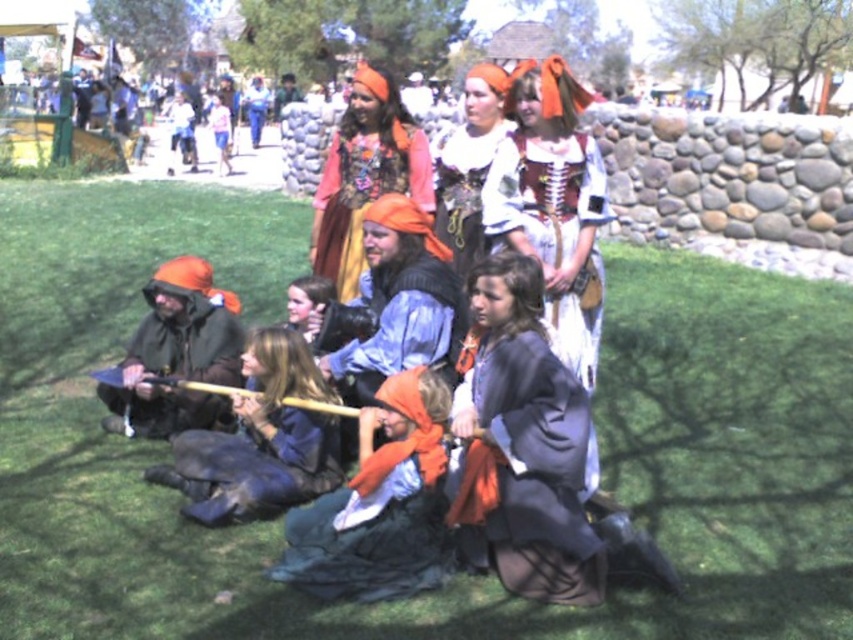
Identify the location of green grass at center. This screenshot has width=853, height=640. (460, 577).

Is green grass at center thinner than orange fabric hood at center?

In fact, green grass at center might be wider than orange fabric hood at center.

The image size is (853, 640). Find the location of `green grass at center`. green grass at center is located at coordinates (460, 577).

Which is below, green grass at center or brown leather jacket at lower left?

brown leather jacket at lower left is lower down.

Is point (132, 186) in front of point (312, 483)?

That is False.

At what (x,y) coordinates should I click in order to perform the action: click on green grass at center. Please return your answer as a coordinate pair (x, y). The image size is (853, 640). Looking at the image, I should click on (460, 577).

Is green grass at center positioned at the back of matte orange headscarf at center?

That is False.

Looking at this image, is green grass at center above matte orange headscarf at center?

Actually, green grass at center is below matte orange headscarf at center.

Find the location of a particular element. This screenshot has height=640, width=853. green grass at center is located at coordinates (460, 577).